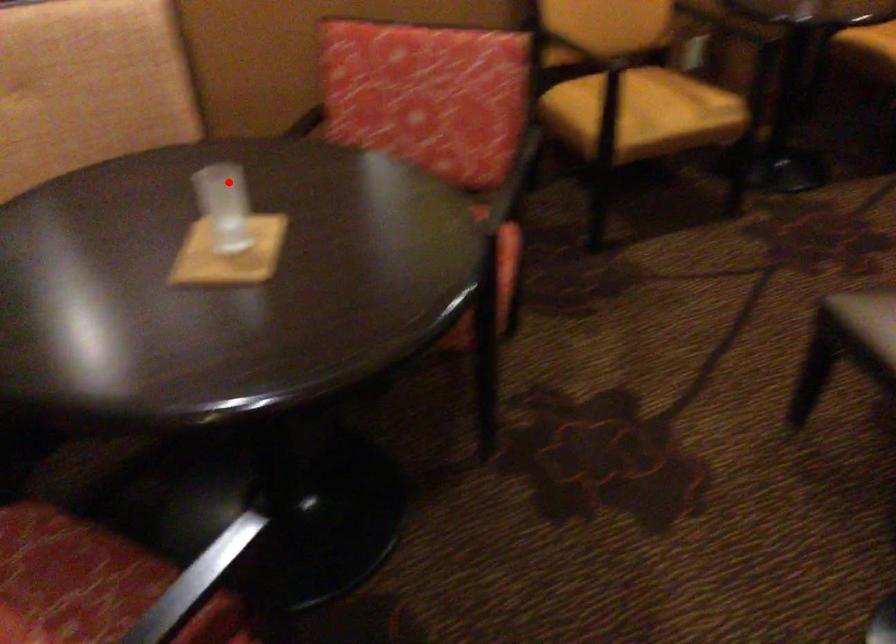
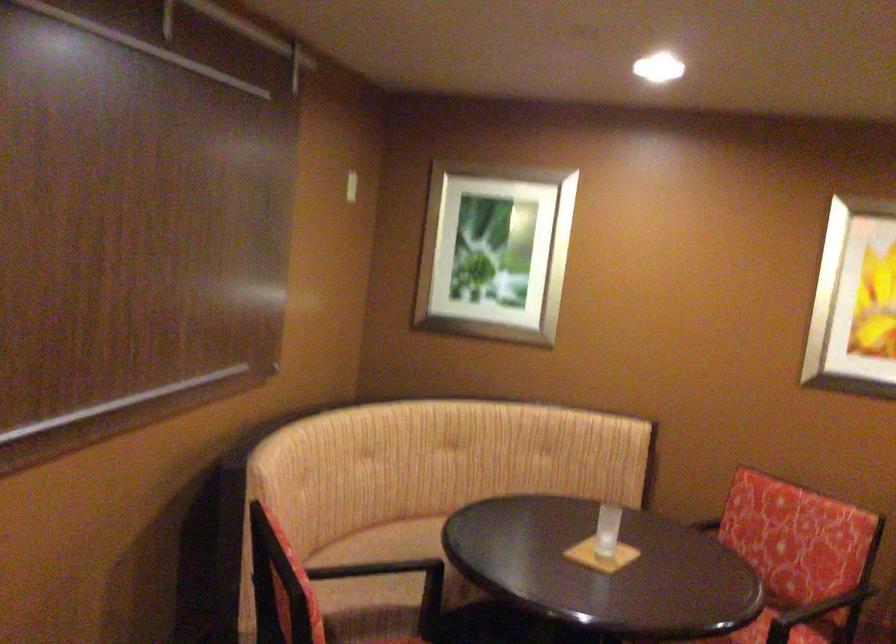
Question: I am providing you with two images of the same scene from different viewpoints. Given a red point in image1, look at the same physical point in image2. Is it:

Choices:
 (A) Closer to the viewpoint
 (B) Farther from the viewpoint

Answer: (B)